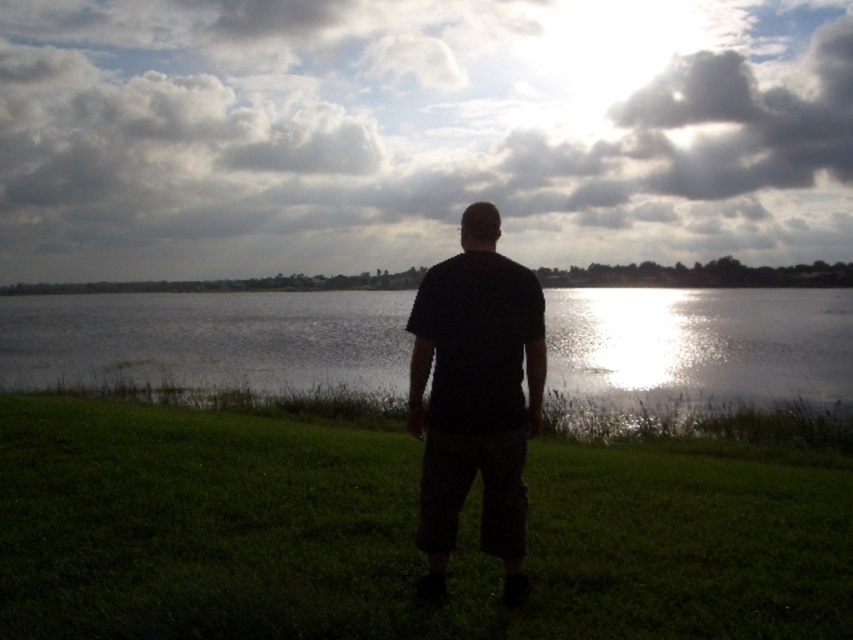
Does cloudy sky at upper center come behind black matte shirt at center?

Yes, cloudy sky at upper center is further from the viewer.

Image resolution: width=853 pixels, height=640 pixels. I want to click on cloudy sky at upper center, so click(x=418, y=132).

Between point (670, 49) and point (312, 440), which one is positioned behind?

The point (670, 49) is behind.

Can you confirm if cloudy sky at upper center is positioned below green grass at center?

No, cloudy sky at upper center is not below green grass at center.

This screenshot has height=640, width=853. Find the location of `cloudy sky at upper center`. cloudy sky at upper center is located at coordinates (418, 132).

Can you confirm if glistening water at center is wider than black matte shirt at center?

Yes.

Who is shorter, glistening water at center or black matte shirt at center?

Standing shorter between the two is black matte shirt at center.

What do you see at coordinates (207, 339) in the screenshot? This screenshot has width=853, height=640. I see `glistening water at center` at bounding box center [207, 339].

Image resolution: width=853 pixels, height=640 pixels. Identify the location of glistening water at center. (207, 339).